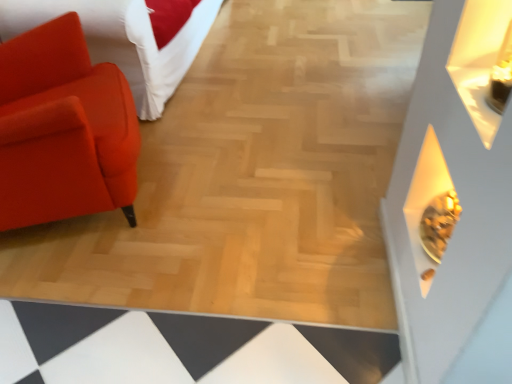
Question: Choose the correct answer: Is matte orange sofa at left inside matte orange chair at left or outside it?

Choices:
 (A) outside
 (B) inside

Answer: (A)

Question: Considering the positions of matte orange sofa at left and matte orange chair at left in the image, is matte orange sofa at left wider or thinner than matte orange chair at left?

Choices:
 (A) wide
 (B) thin

Answer: (A)

Question: From a real-world perspective, is matte orange sofa at left positioned above or below matte orange chair at left?

Choices:
 (A) above
 (B) below

Answer: (B)

Question: Looking at their shapes, would you say matte orange chair at left is wider or thinner than matte orange sofa at left?

Choices:
 (A) thin
 (B) wide

Answer: (A)

Question: In terms of height, does matte orange chair at left look taller or shorter compared to matte orange sofa at left?

Choices:
 (A) short
 (B) tall

Answer: (B)

Question: From the image's perspective, relative to matte orange sofa at left, is matte orange chair at left above or below?

Choices:
 (A) above
 (B) below

Answer: (B)

Question: Based on their sizes in the image, would you say matte orange chair at left is bigger or smaller than matte orange sofa at left?

Choices:
 (A) big
 (B) small

Answer: (B)